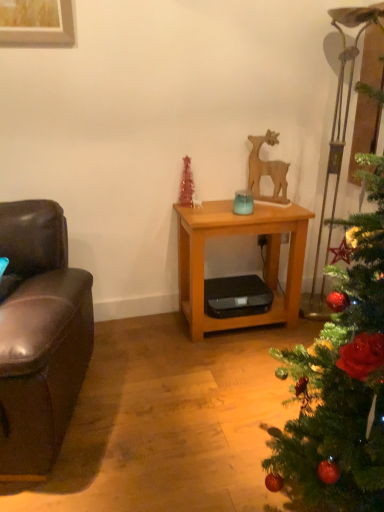
Question: Relative to wooden deer at center, is wooden table at center in front or behind?

Choices:
 (A) front
 (B) behind

Answer: (A)

Question: Is point (248, 220) closer or farther from the camera than point (254, 162)?

Choices:
 (A) farther
 (B) closer

Answer: (B)

Question: Which of these objects is positioned closest to the wooden deer at center?

Choices:
 (A) green matte christmas tree at right
 (B) brown leather couch at left
 (C) wooden table at center

Answer: (C)

Question: Which object is the closest to the wooden deer at center?

Choices:
 (A) wooden table at center
 (B) green matte christmas tree at right
 (C) brown leather couch at left

Answer: (A)